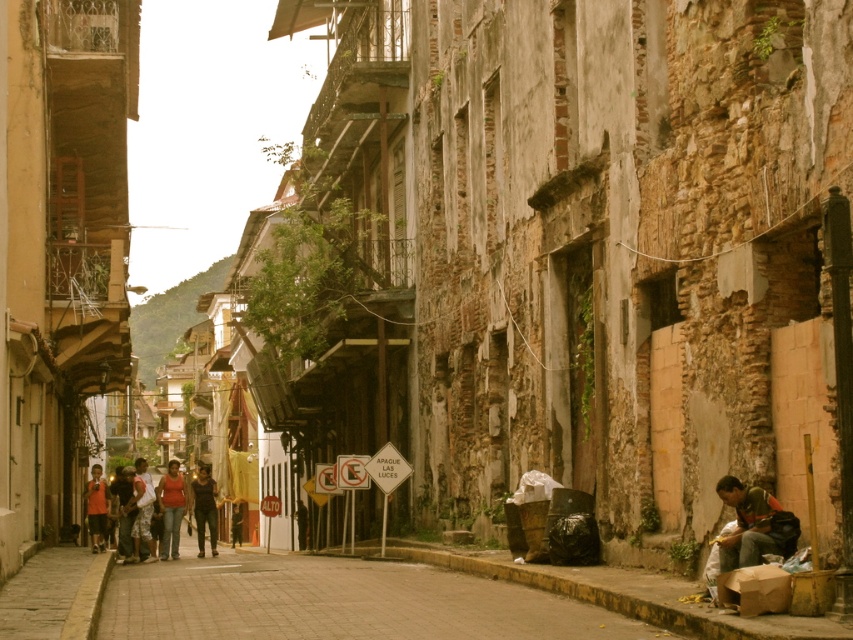
Consider the image. You are a photographer trying to capture a candid shot of the matte black shirt at center and the dark blue jeans at center in the historic street scene. Since you want to ensure both are clearly visible, which clothing item should you focus on first to account for their size difference?

The matte black shirt at center is larger than the dark blue jeans at center, so you should focus on the matte black shirt at center first to ensure it is in clear focus before adjusting for the smaller dark blue jeans at center.

You are a pedestrian standing on the orange fabric shirt at lower left. Looking ahead, can you see the brown brick pavement at center in your line of sight?

Yes, the brown brick pavement at center is to the right of orange fabric shirt at lower left, so it would be visible in your line of sight.

You are a delivery person standing at the entrance of the street. You need to deliver a package to the matte black shirt at center who is 83.61 meters away. The delivery vehicle can only move forward in a straight line. Is there enough space between the buildings and the pedestrians to make the delivery?

The matte black shirt at center is 83.61 meters away. Since the delivery vehicle can move in a straight line and the street is narrow but the distance is specified, the vehicle can proceed as there is a clear path unless blocked by pedestrians. However, the question does not mention obstacles, so based on given info, yes, there is enough space.